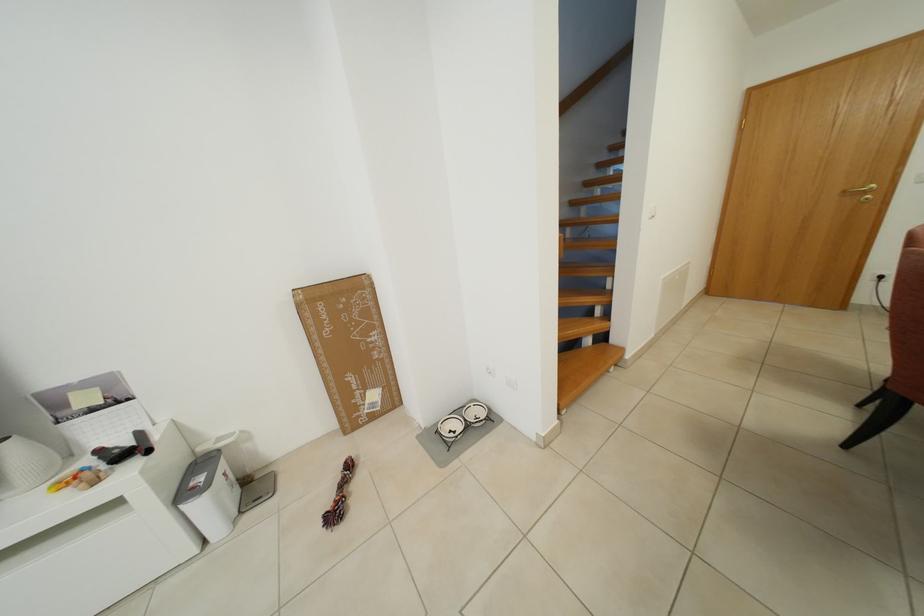
The location [338,496] corresponds to which object?

It refers to a braided rope toy.